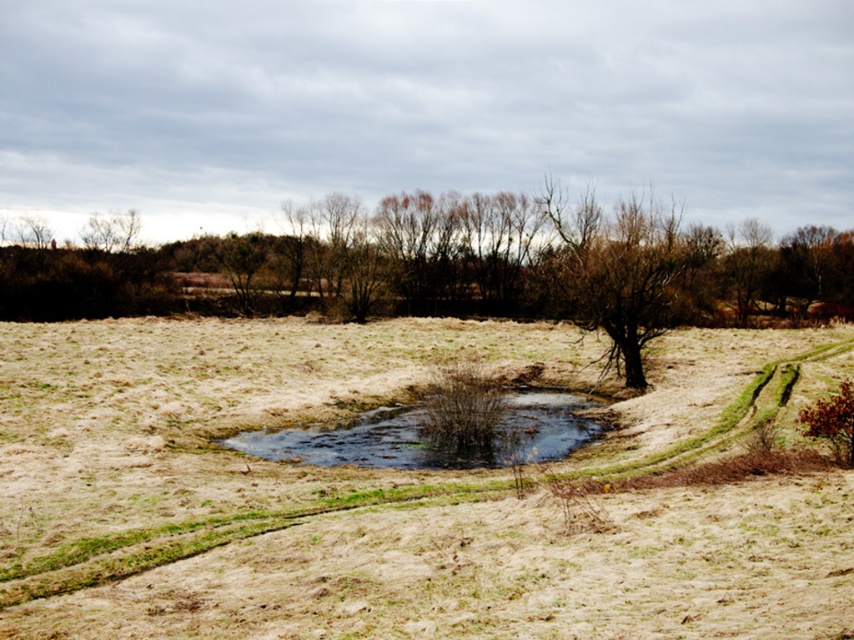
Question: Which point is closer to the camera taking this photo?

Choices:
 (A) (279, 388)
 (B) (577, 212)

Answer: (A)

Question: Does brown grassy field at center appear on the right side of dark green water at center?

Choices:
 (A) no
 (B) yes

Answer: (B)

Question: In this image, where is brown/dry wood tree at center located relative to dark green water at center?

Choices:
 (A) below
 (B) above

Answer: (B)

Question: Can you confirm if brown grassy field at center is positioned to the left of dark green water at center?

Choices:
 (A) yes
 (B) no

Answer: (B)

Question: Among these objects, which one is nearest to the camera?

Choices:
 (A) brown grassy field at center
 (B) dark green water at center
 (C) brown/dry wood tree at center

Answer: (A)

Question: Which object is farther from the camera taking this photo?

Choices:
 (A) brown grassy field at center
 (B) brown/dry wood tree at center

Answer: (B)